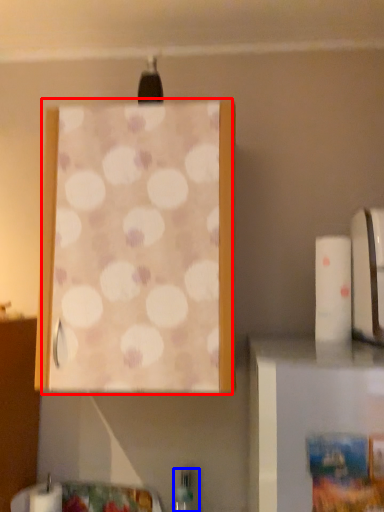
Question: Which object is closer to the camera taking this photo, curtain (highlighted by a red box) or bottle (highlighted by a blue box)?

Choices:
 (A) curtain
 (B) bottle

Answer: (A)